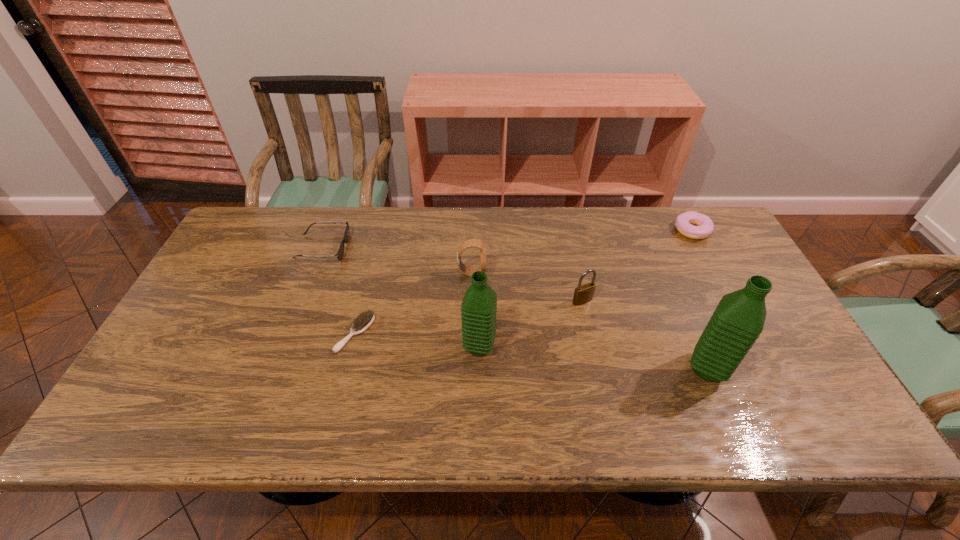
Identify the location of vacant point located between the watch and the second object from right to left. click(589, 321).

The image size is (960, 540). I want to click on vacant space that's between the fourth nearest object and the left water bottle, so click(531, 324).

This screenshot has height=540, width=960. What are the coordinates of `empty location between the doughnut and the sunglasses` in the screenshot? It's located at coord(508,239).

The width and height of the screenshot is (960, 540). What are the coordinates of `vacant area between the left water bottle and the tallest object` in the screenshot? It's located at tap(593, 358).

You are a GUI agent. You are given a task and a screenshot of the screen. Output one action in this format:
    pyautogui.click(x=<x>, y=<y>)
    Task: Click on the vacant area that lies between the tallest object and the left water bottle
    This screenshot has height=540, width=960.
    Given the screenshot: What is the action you would take?
    pyautogui.click(x=593, y=358)

Where is `free space between the left water bottle and the leftmost object`? The width and height of the screenshot is (960, 540). free space between the left water bottle and the leftmost object is located at coordinates (401, 297).

Locate an element on the screen. Image resolution: width=960 pixels, height=540 pixels. object that is the third closest to the padlock is located at coordinates (471, 243).

Point out which object is positioned as the fourth nearest to the shortest object. Please provide its 2D coordinates. Your answer should be formatted as a tuple, i.e. [(x, y)], where the tuple contains the x and y coordinates of a point satisfying the conditions above.

[(583, 294)]

Where is `vacant space that satisfies the following two spatial constraints: 1. on the back side of the scrubbing brush; 2. on the front-facing side of the leftmost object`? vacant space that satisfies the following two spatial constraints: 1. on the back side of the scrubbing brush; 2. on the front-facing side of the leftmost object is located at coordinates (376, 248).

Identify the location of vacant space that satisfies the following two spatial constraints: 1. on the front-facing side of the padlock; 2. on the right side of the leftmost object. Image resolution: width=960 pixels, height=540 pixels. (302, 301).